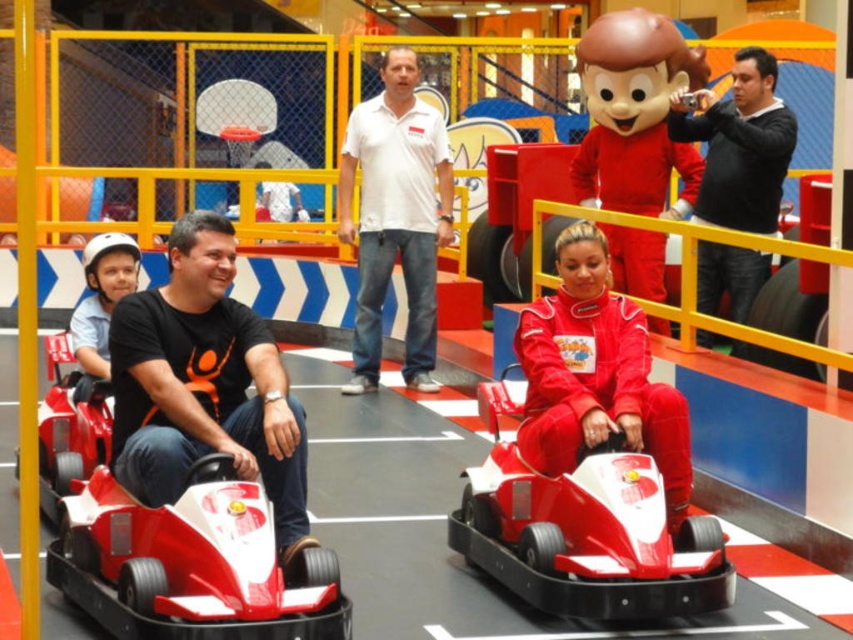
Is shiny red race car at center taller than matte red mascot at center?

Incorrect, shiny red race car at center's height is not larger of matte red mascot at center's.

Which is more to the right, shiny red race car at center or matte red mascot at center?

matte red mascot at center

Find the location of a particular element. shiny red race car at center is located at coordinates (189, 561).

Who is positioned more to the right, shiny red toy car at center or black matte jacket at upper right?

black matte jacket at upper right

Is shiny red toy car at center behind black matte jacket at upper right?

No, shiny red toy car at center is in front of black matte jacket at upper right.

Identify the location of shiny red toy car at center. The width and height of the screenshot is (853, 640). (585, 531).

Does point (288, 481) lie in front of point (103, 344)?

Yes, it is.

Does matte black t-shirt at center appear under matte black helmet at left?

Yes, matte black t-shirt at center is below matte black helmet at left.

Image resolution: width=853 pixels, height=640 pixels. What are the coordinates of `matte black t-shirt at center` in the screenshot? It's located at (204, 385).

This screenshot has width=853, height=640. In order to click on matte black t-shirt at center in this screenshot , I will do click(204, 385).